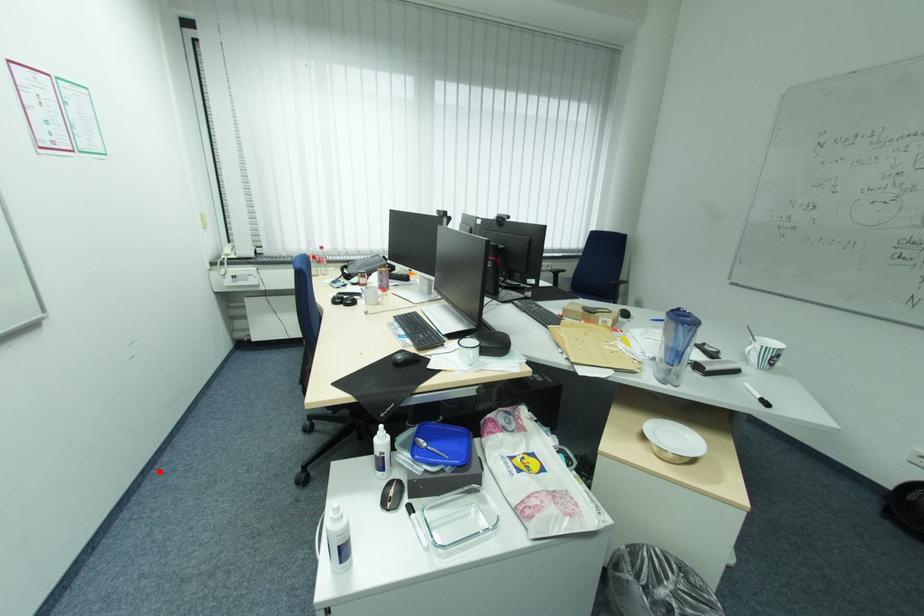
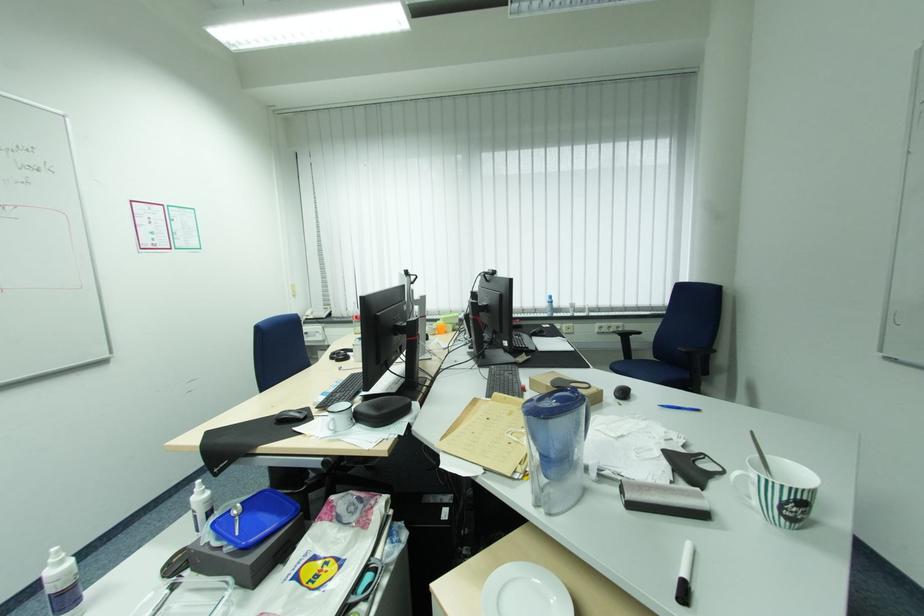
Question: A red point is marked in image1. In image2, is the corresponding 3D point closer to the camera or farther? Reply with the corresponding letter.

Choices:
 (A) The corresponding 3D point is closer.
 (B) The corresponding 3D point is farther.

Answer: (A)